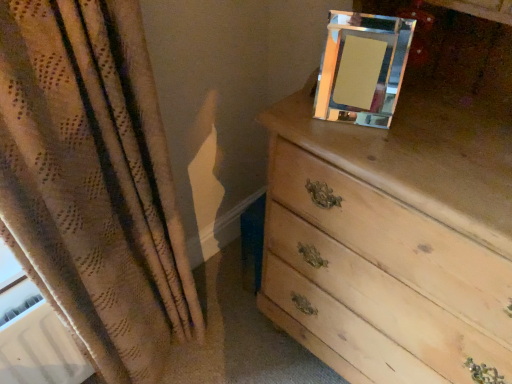
What do you see at coordinates (362, 68) in the screenshot?
I see `clear glass picture frame at upper right` at bounding box center [362, 68].

The image size is (512, 384). Identify the location of clear glass picture frame at upper right. (362, 68).

Image resolution: width=512 pixels, height=384 pixels. What do you see at coordinates (393, 232) in the screenshot? I see `light wood chest of drawers at upper right` at bounding box center [393, 232].

I want to click on light wood chest of drawers at upper right, so click(393, 232).

The width and height of the screenshot is (512, 384). I want to click on clear glass picture frame at upper right, so click(x=362, y=68).

Which object is positioned more to the right, light wood chest of drawers at upper right or clear glass picture frame at upper right?

light wood chest of drawers at upper right is more to the right.

Based on the photo, considering the positions of objects light wood chest of drawers at upper right and clear glass picture frame at upper right in the image provided, who is behind, light wood chest of drawers at upper right or clear glass picture frame at upper right?

clear glass picture frame at upper right is further from the camera.

In the scene shown: Which is closer, (x=443, y=250) or (x=370, y=33)?

Point (x=443, y=250) is positioned closer to the camera compared to point (x=370, y=33).

From the image's perspective, is light wood chest of drawers at upper right located above or below clear glass picture frame at upper right?

Clearly, from the image's perspective, light wood chest of drawers at upper right is below clear glass picture frame at upper right.

From a real-world perspective, between light wood chest of drawers at upper right and clear glass picture frame at upper right, who is vertically higher?

From a 3D spatial view, clear glass picture frame at upper right is above.

Which of these two, light wood chest of drawers at upper right or clear glass picture frame at upper right, is thinner?

With smaller width is clear glass picture frame at upper right.

Does light wood chest of drawers at upper right have a greater height compared to clear glass picture frame at upper right?

Yes.

Can you confirm if light wood chest of drawers at upper right is bigger than clear glass picture frame at upper right?

Yes.

Is light wood chest of drawers at upper right inside or outside of clear glass picture frame at upper right?

light wood chest of drawers at upper right lies outside clear glass picture frame at upper right.

Does light wood chest of drawers at upper right touch clear glass picture frame at upper right?

No, light wood chest of drawers at upper right is not in contact with clear glass picture frame at upper right.

Does light wood chest of drawers at upper right turn towards clear glass picture frame at upper right?

Yes.

Identify the location of chest of drawers located on the right of clear glass picture frame at upper right. Image resolution: width=512 pixels, height=384 pixels. (393, 232).

Which object is positioned more to the right, clear glass picture frame at upper right or light wood chest of drawers at upper right?

Positioned to the right is light wood chest of drawers at upper right.

Does clear glass picture frame at upper right come in front of light wood chest of drawers at upper right?

No.

Does point (362, 93) come in front of point (388, 254)?

Yes, point (362, 93) is closer to viewer.

From the image's perspective, which is above, clear glass picture frame at upper right or light wood chest of drawers at upper right?

From the image's view, clear glass picture frame at upper right is above.

From a real-world perspective, is clear glass picture frame at upper right located beneath light wood chest of drawers at upper right?

No, from a real-world perspective, clear glass picture frame at upper right is not beneath light wood chest of drawers at upper right.

Is clear glass picture frame at upper right wider than light wood chest of drawers at upper right?

No, clear glass picture frame at upper right is not wider than light wood chest of drawers at upper right.

Considering the sizes of objects clear glass picture frame at upper right and light wood chest of drawers at upper right in the image provided, who is shorter, clear glass picture frame at upper right or light wood chest of drawers at upper right?

With less height is clear glass picture frame at upper right.

Is clear glass picture frame at upper right bigger than light wood chest of drawers at upper right?

Actually, clear glass picture frame at upper right might be smaller than light wood chest of drawers at upper right.

Is clear glass picture frame at upper right outside of light wood chest of drawers at upper right?

No, clear glass picture frame at upper right is not outside of light wood chest of drawers at upper right.

Is clear glass picture frame at upper right next to light wood chest of drawers at upper right?

No, clear glass picture frame at upper right is not making contact with light wood chest of drawers at upper right.

Is clear glass picture frame at upper right positioned with its back to light wood chest of drawers at upper right?

Yes, clear glass picture frame at upper right is facing away from light wood chest of drawers at upper right.

Locate an element on the screen. The width and height of the screenshot is (512, 384). chest of drawers on the right of the clear glass picture frame at upper right is located at coordinates (393, 232).

Where is `picture frame that appears above the light wood chest of drawers at upper right (from a real-world perspective)`? The height and width of the screenshot is (384, 512). picture frame that appears above the light wood chest of drawers at upper right (from a real-world perspective) is located at coordinates [362, 68].

Find the location of a particular element. chest of drawers on the right of clear glass picture frame at upper right is located at coordinates (393, 232).